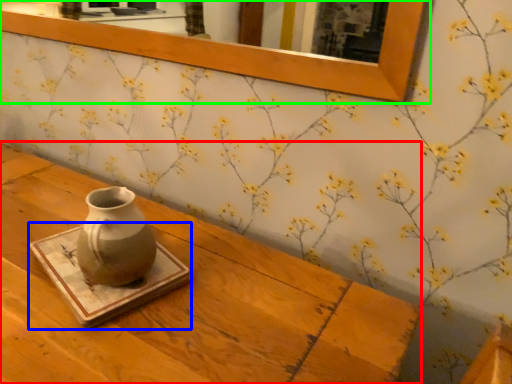
Question: Which is farther away from table (highlighted by a red box)? tray (highlighted by a blue box) or picture frame (highlighted by a green box)?

Choices:
 (A) tray
 (B) picture frame

Answer: (B)